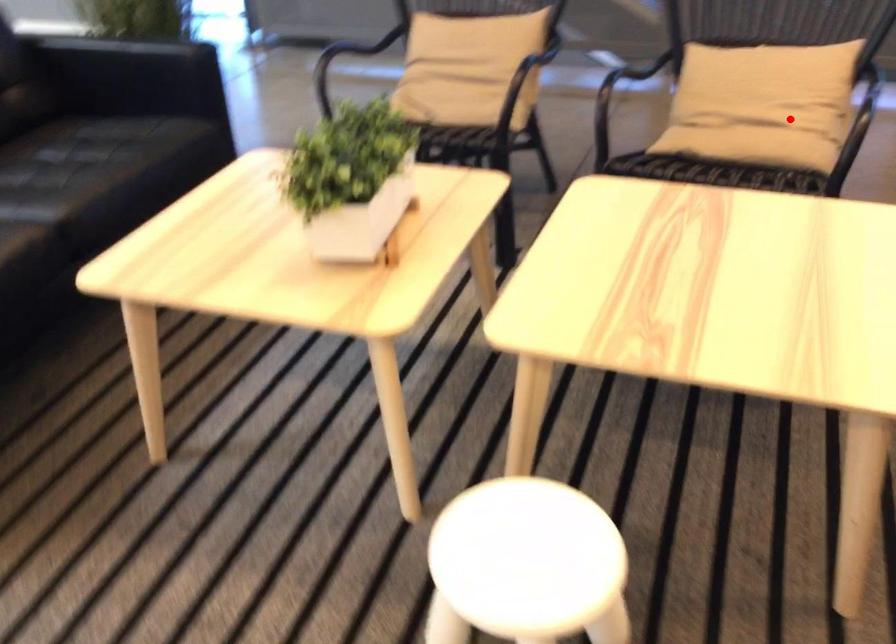
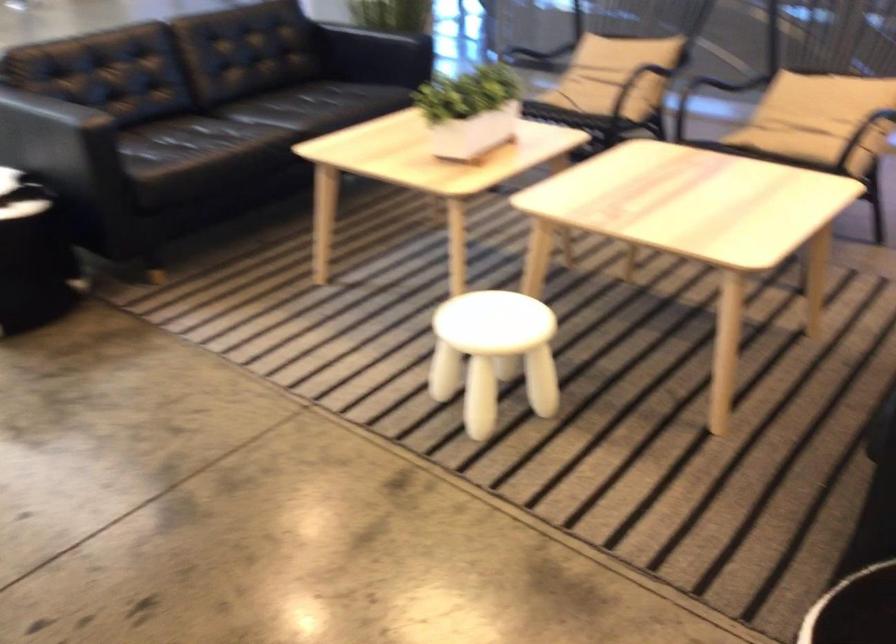
Question: A red point is marked in image1. In image2, is the corresponding 3D point closer to the camera or farther? Reply with the corresponding letter.

Choices:
 (A) The corresponding 3D point is closer.
 (B) The corresponding 3D point is farther.

Answer: (B)